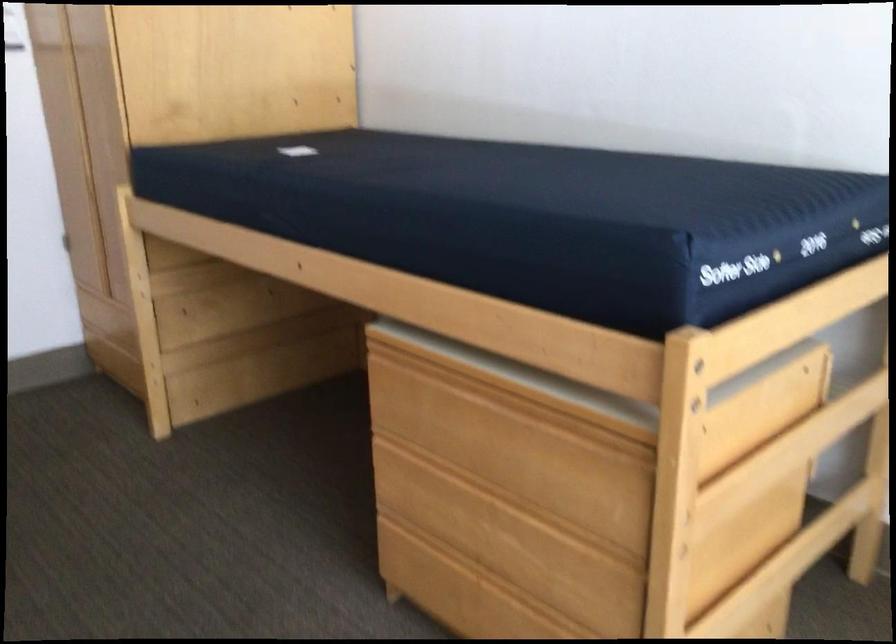
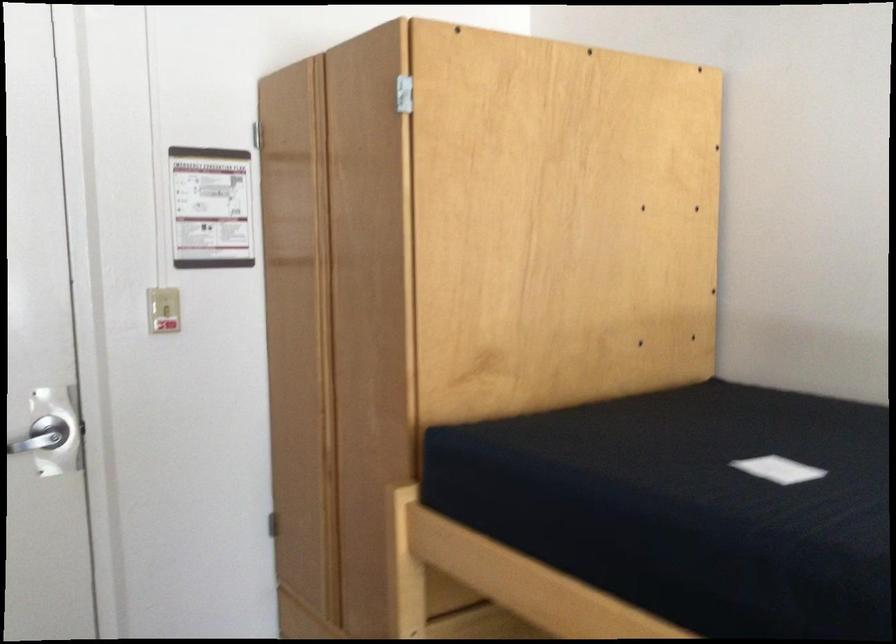
In the second image, find the point that corresponds to point 298,153 in the first image.

(778, 469)